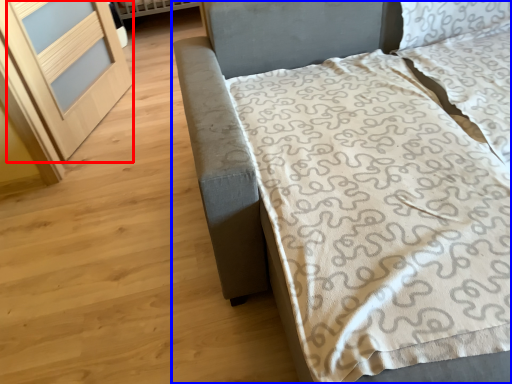
Question: Which point is closer to the camera, screen door (highlighted by a red box) or bed (highlighted by a blue box)?

Choices:
 (A) screen door
 (B) bed

Answer: (B)